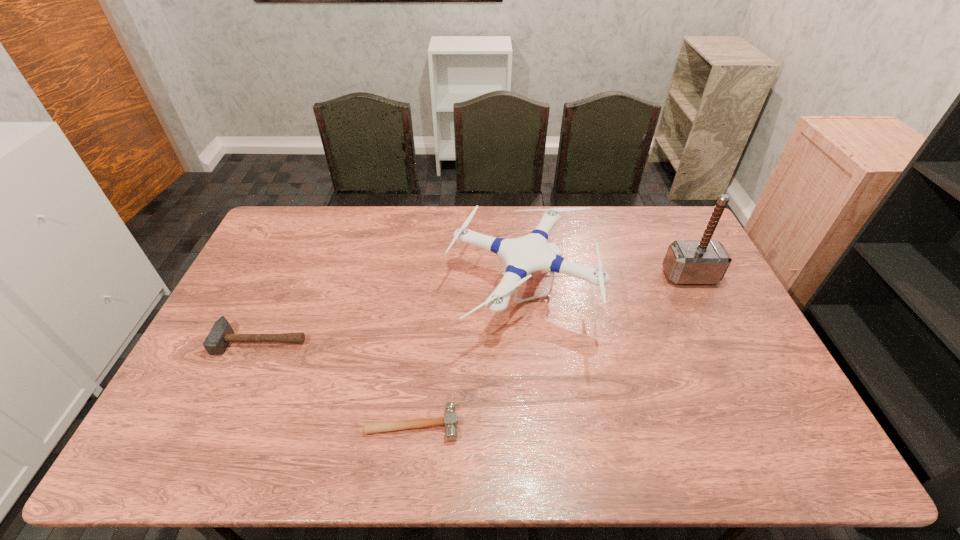
The height and width of the screenshot is (540, 960). Identify the location of hammer that is the nearest to the shortest object. (221, 334).

The image size is (960, 540). I want to click on vacant position in the image that satisfies the following two spatial constraints: 1. on the back side of the rightmost hammer; 2. on the right side of the nearest hammer, so click(430, 276).

Where is `vacant space that satisfies the following two spatial constraints: 1. on the back side of the nearest object; 2. on the left side of the farthest hammer`? This screenshot has width=960, height=540. vacant space that satisfies the following two spatial constraints: 1. on the back side of the nearest object; 2. on the left side of the farthest hammer is located at coordinates (430, 276).

This screenshot has height=540, width=960. I want to click on free space that satisfies the following two spatial constraints: 1. on the back side of the nearest hammer; 2. on the right side of the farthest hammer, so click(430, 276).